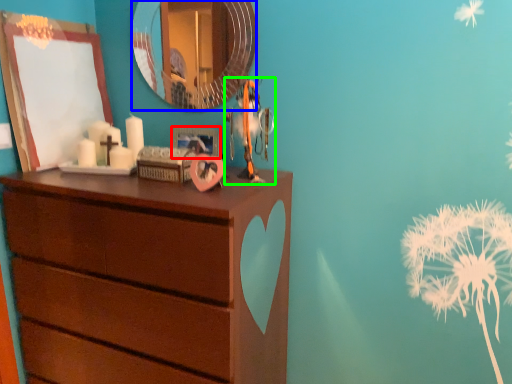
Question: Which object is positioned farthest from picture frame (highlighted by a red box)? Select from mirror (highlighted by a blue box) and toy (highlighted by a green box).

Choices:
 (A) mirror
 (B) toy

Answer: (A)